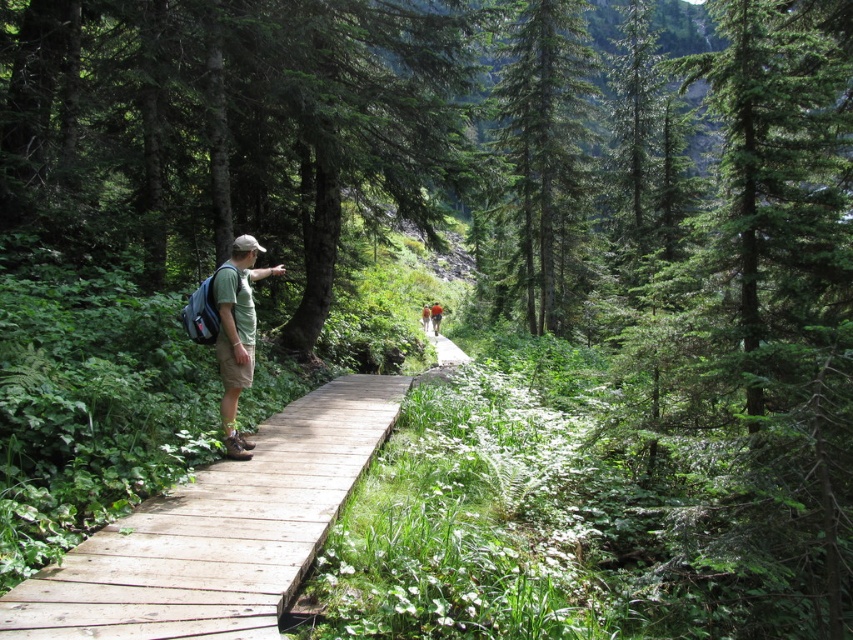
Question: Does green matte tree at center have a larger size compared to green grassy trail at center?

Choices:
 (A) yes
 (B) no

Answer: (A)

Question: Is matte green t-shirt at center bigger than light brown wooden boardwalk at center?

Choices:
 (A) yes
 (B) no

Answer: (B)

Question: Which point is farther from the camera taking this photo?

Choices:
 (A) (440, 307)
 (B) (137, 508)
 (C) (251, 344)

Answer: (A)

Question: Where is wooden bridge at center located in relation to green grassy trail at center in the image?

Choices:
 (A) left
 (B) right

Answer: (A)

Question: Which of the following is the farthest from the observer?

Choices:
 (A) (164, 634)
 (B) (436, 358)
 (C) (438, 316)
 (D) (239, 243)

Answer: (C)

Question: Which object is closer to the camera taking this photo?

Choices:
 (A) wooden bridge at center
 (B) green matte tree at center

Answer: (A)